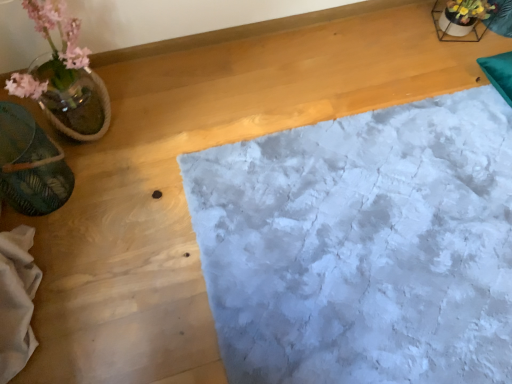
The width and height of the screenshot is (512, 384). Identify the location of free space in front of green leafy material at left. (58, 249).